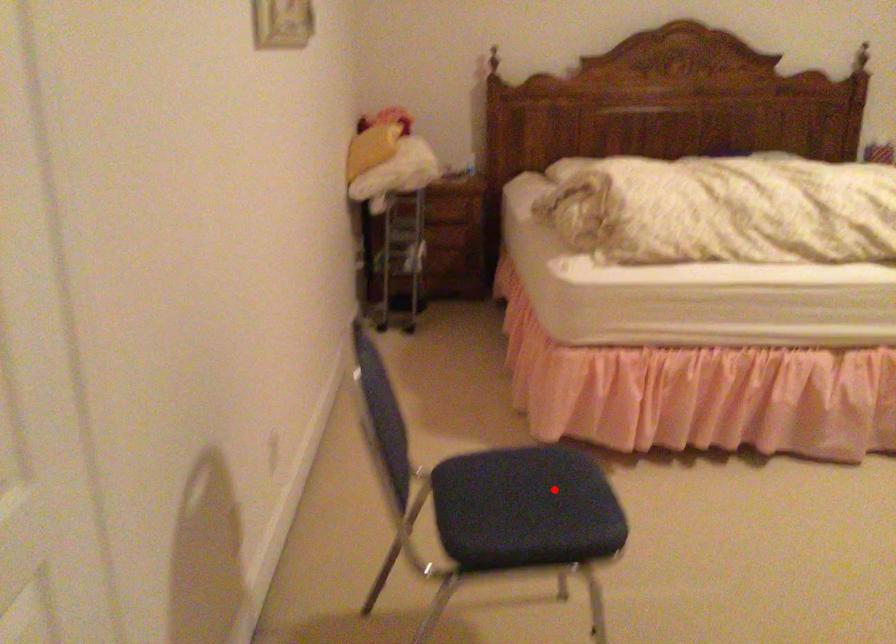
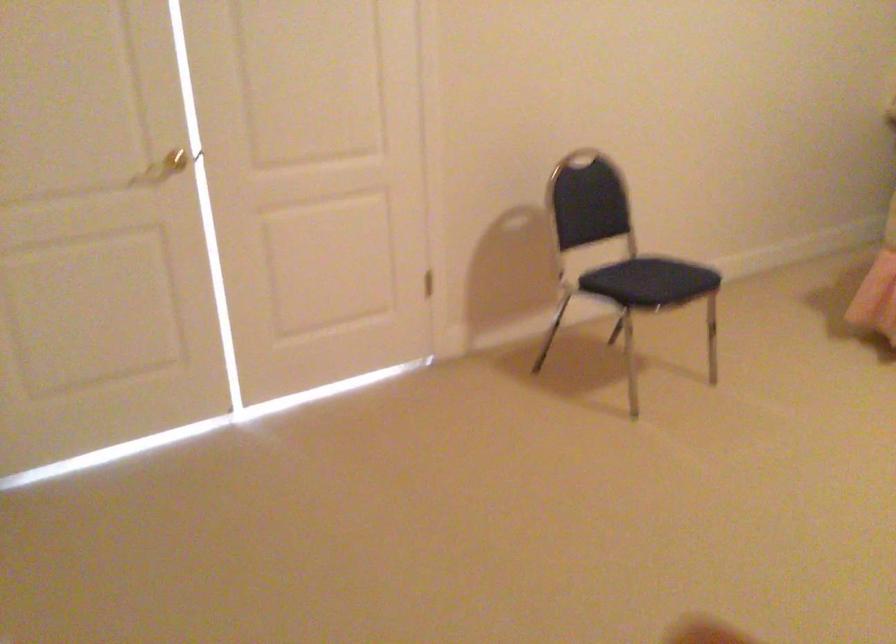
Question: I am providing you with two images of the same scene from different viewpoints. Image1 has a red point marked. In image2, the corresponding 3D location appears at what relative position? Reply with the corresponding letter.

Choices:
 (A) Closer
 (B) Farther

Answer: (B)